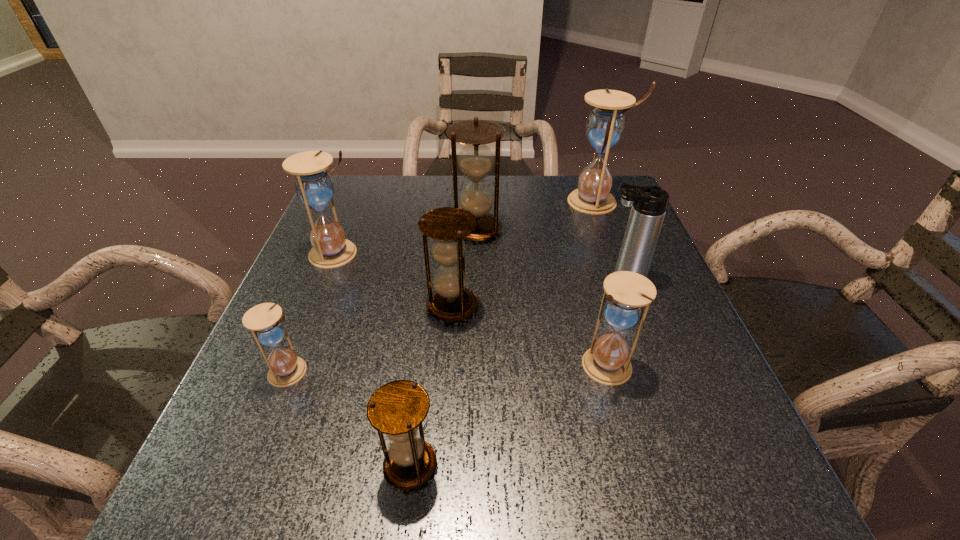
Where is `the farthest white hourglass`? The height and width of the screenshot is (540, 960). the farthest white hourglass is located at coordinates (605, 126).

At what (x,y) coordinates should I click in order to perform the action: click on the biggest white hourglass. Please return your answer as a coordinate pair (x, y). Looking at the image, I should click on (605, 126).

Where is `the biggest brown hourglass`? the biggest brown hourglass is located at coordinates coord(475,160).

Where is `the third smallest white hourglass`? This screenshot has height=540, width=960. the third smallest white hourglass is located at coordinates (314, 187).

Identify the location of thermos bottle. The width and height of the screenshot is (960, 540). tap(649, 203).

Where is `the second farthest brown hourglass`? The height and width of the screenshot is (540, 960). the second farthest brown hourglass is located at coordinates (451, 301).

The width and height of the screenshot is (960, 540). Find the location of `the fourth farthest hourglass`. the fourth farthest hourglass is located at coordinates (451, 301).

Find the location of a particular element. The width and height of the screenshot is (960, 540). the third biggest white hourglass is located at coordinates (607, 362).

I want to click on the smallest white hourglass, so click(265, 321).

The width and height of the screenshot is (960, 540). Identify the location of the nearest hourglass. (397, 409).